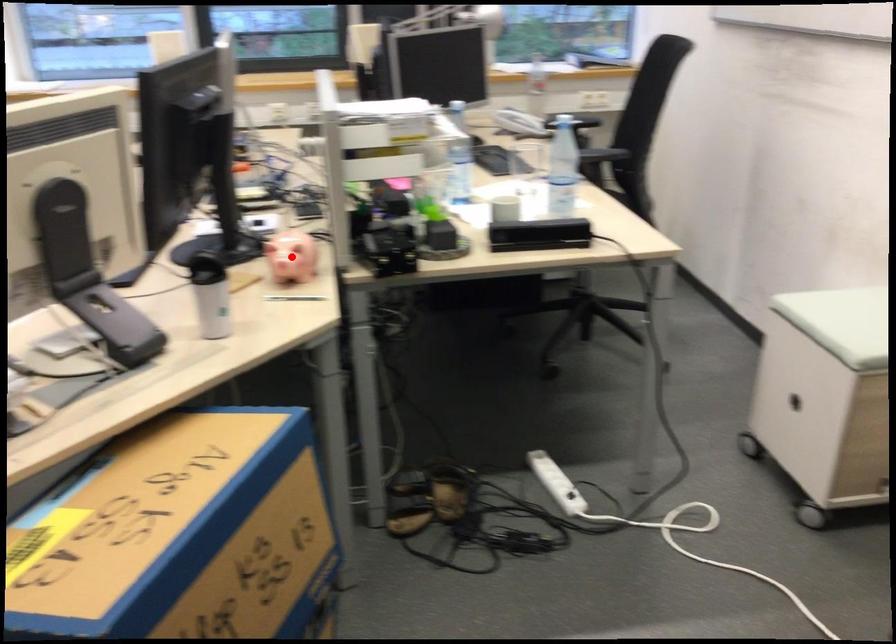
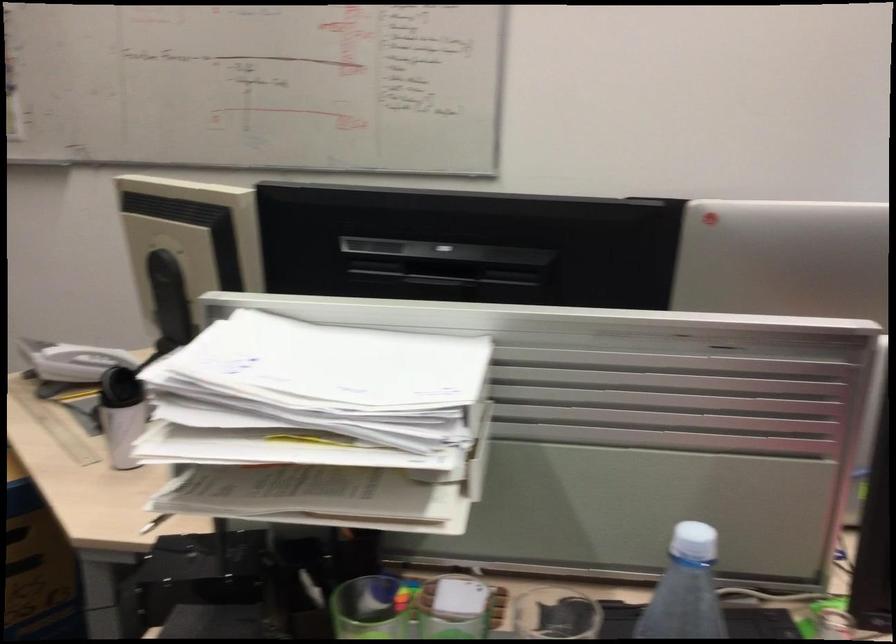
Question: I am providing you with two images of the same scene from different viewpoints. A red point is marked on the first image. Is the red point's position out of view in image 2?

Choices:
 (A) Yes
 (B) No

Answer: (A)